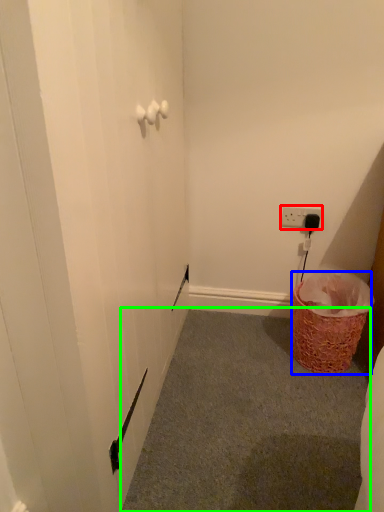
Question: Which is nearer to the electric outlet (highlighted by a red box)? basket (highlighted by a blue box) or plain (highlighted by a green box).

Choices:
 (A) basket
 (B) plain

Answer: (A)